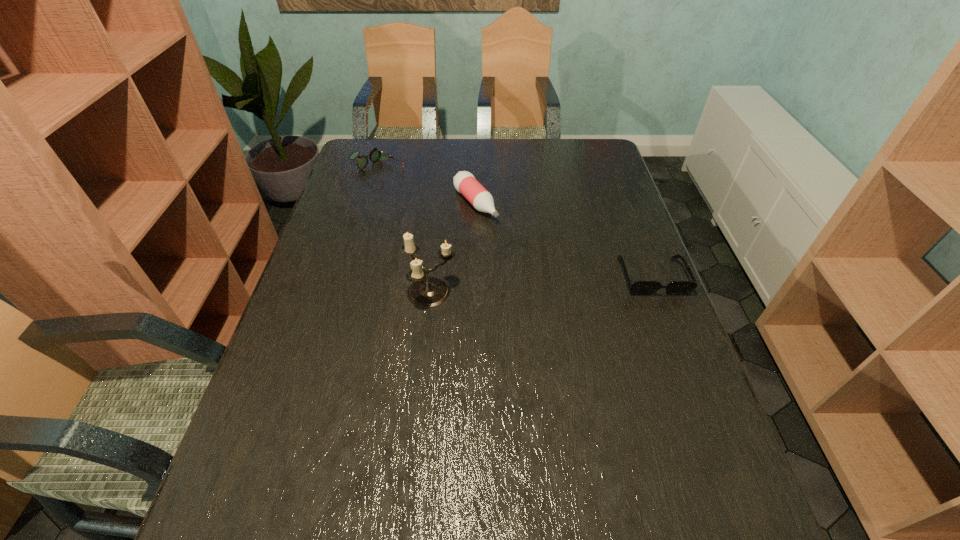
Locate an element on the screen. The height and width of the screenshot is (540, 960). free space between the rightmost object and the third nearest object is located at coordinates (564, 240).

Find the location of `vacant space that is in between the tallest object and the leftmost object`. vacant space that is in between the tallest object and the leftmost object is located at coordinates (404, 232).

The width and height of the screenshot is (960, 540). I want to click on free space that is in between the spectacles and the rightmost object, so click(x=515, y=224).

Find the location of a particular element. empty location between the leftmost object and the second farthest object is located at coordinates (426, 187).

The image size is (960, 540). Find the location of `the closest object to the candle holder`. the closest object to the candle holder is located at coordinates (464, 182).

Locate an element on the screen. Image resolution: width=960 pixels, height=540 pixels. object that ranks as the second closest to the tallest object is located at coordinates (375, 154).

The height and width of the screenshot is (540, 960). In order to click on vacant area that satisfies the following two spatial constraints: 1. on the front side of the leftmost object; 2. on the right side of the bottle in this screenshot , I will do `click(367, 204)`.

Image resolution: width=960 pixels, height=540 pixels. Find the location of `free location that satisfies the following two spatial constraints: 1. on the front side of the candle holder; 2. on the left side of the spectacles`. free location that satisfies the following two spatial constraints: 1. on the front side of the candle holder; 2. on the left side of the spectacles is located at coordinates (341, 293).